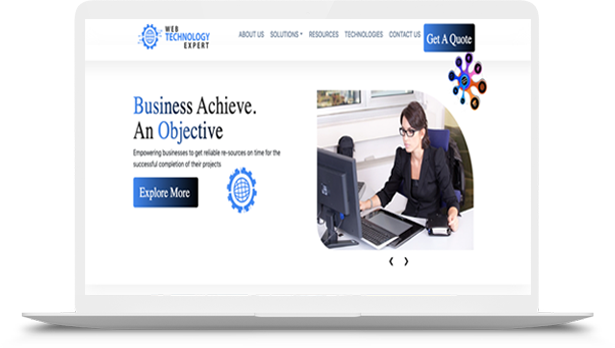
What are the coordinates of `keyboard` in the screenshot? It's located at (379, 233).